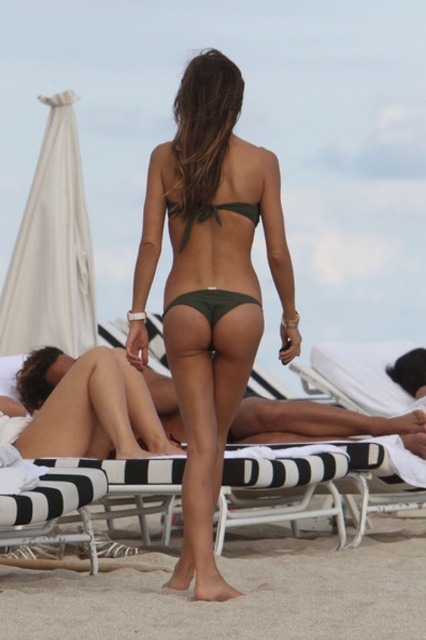
You are standing at the point marked as point (x=137, y=480) and want to walk to the lounge chairs in the background. The distance between you and the lounge chairs is 21.57 feet. If you walk at a speed of 3 feet per second, how many seconds will it take you to reach the lounge chairs?

The distance between you and the lounge chairs is 21.57 feet. At a speed of 3 feet per second, it will take 21.57 divided by 3, which equals approximately 7.19 seconds to reach the lounge chairs.

You are a photographer trying to capture the woman walking towards the lounge chairs. You notice the green matte bikini bottom at center and the sandy beach at lower center. Which object is positioned more to the left in the image?

The green matte bikini bottom at center is positioned to the left of the sandy beach at lower center, so it is more to the left.